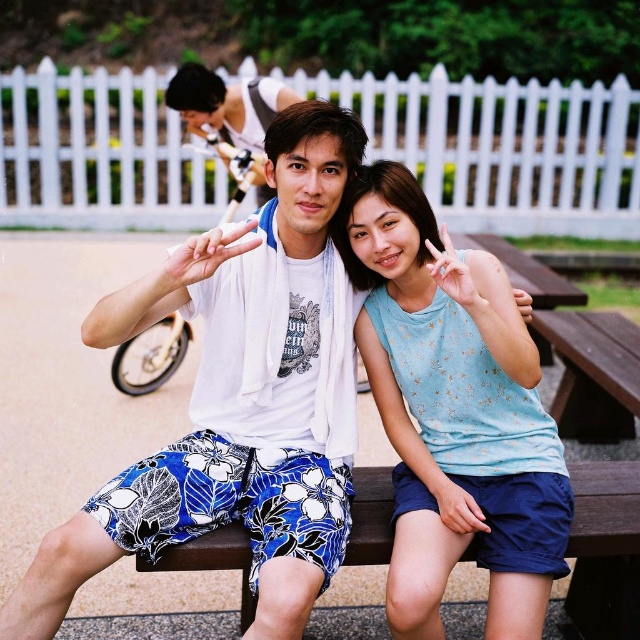
Question: In this image, where is light blue fabric tank top at center located relative to matte white shirt at center?

Choices:
 (A) above
 (B) below

Answer: (B)

Question: Which of the following is the closest to the observer?

Choices:
 (A) (202, 72)
 (B) (381, 490)
 (C) (448, 448)

Answer: (C)

Question: Which object appears closest to the camera in this image?

Choices:
 (A) white cotton shirt at center
 (B) brown wooden bench at center
 (C) light blue fabric tank top at center
 (D) matte white shirt at center

Answer: (A)

Question: Among these points, which one is nearest to the camera?

Choices:
 (A) (627, 474)
 (B) (108, 310)

Answer: (B)

Question: Can you confirm if white cotton shirt at center is wider than matte white shirt at center?

Choices:
 (A) yes
 (B) no

Answer: (A)

Question: Is white cotton shirt at center to the left of brown wooden bench at center from the viewer's perspective?

Choices:
 (A) no
 (B) yes

Answer: (B)